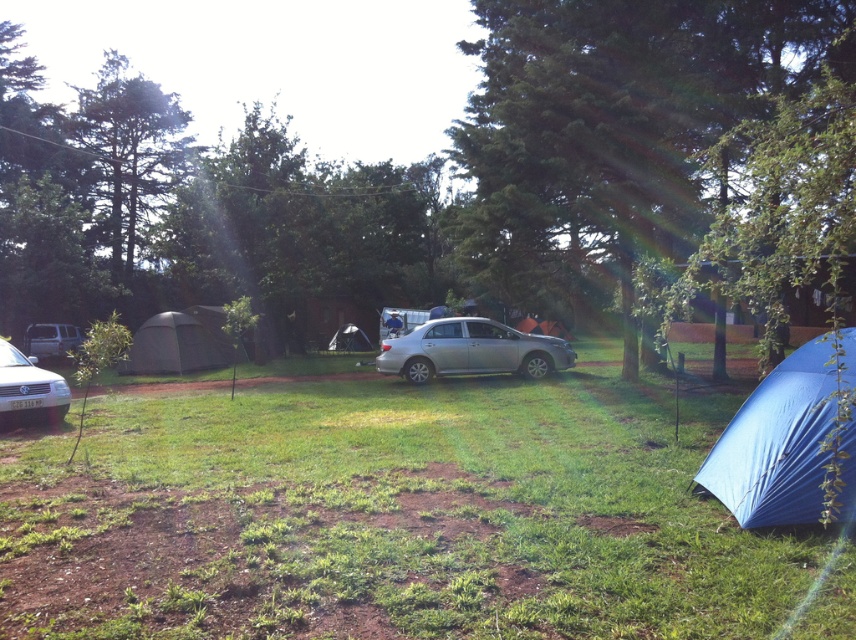
Question: Does blue tarpaulin tent at lower right have a smaller size compared to blue tarpaulin tent at center?

Choices:
 (A) yes
 (B) no

Answer: (B)

Question: Considering the relative positions of blue tarpaulin tent at lower right and silver metallic car at lower left in the image provided, where is blue tarpaulin tent at lower right located with respect to silver metallic car at lower left?

Choices:
 (A) below
 (B) above

Answer: (B)

Question: Which object is closer to the camera taking this photo?

Choices:
 (A) metallic silver van at left
 (B) green leafy tree at center
 (C) silver metallic car at center
 (D) silver metallic car at lower left

Answer: (B)

Question: Which object appears farthest from the camera in this image?

Choices:
 (A) silver metallic car at center
 (B) blue tarpaulin tent at center
 (C) blue tarpaulin tent at lower right

Answer: (B)

Question: Is green leafy tree at center positioned before metallic silver van at left?

Choices:
 (A) yes
 (B) no

Answer: (A)

Question: Among these objects, which one is farthest from the camera?

Choices:
 (A) silver metallic car at center
 (B) blue tarpaulin tent at center

Answer: (B)